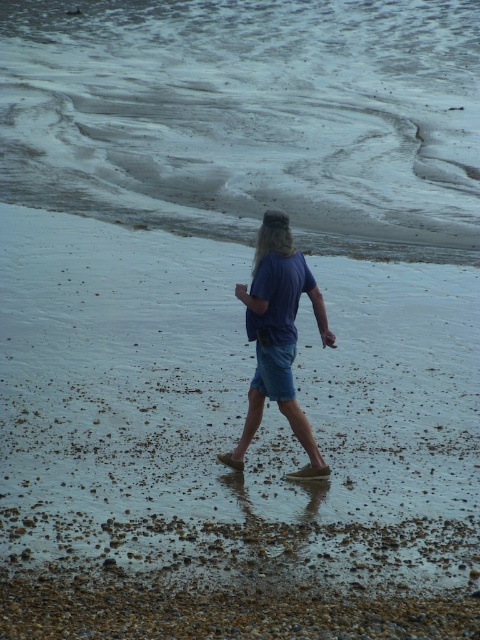
You are a hiker who wants to cross the beach to reach the water. You see the sandy water at center and the blue denim shorts at center. Which one is higher in elevation?

The sandy water at center is taller than blue denim shorts at center, so the sandy water at center is higher in elevation.

You are a photographer trying to capture the person walking on the beach. Which object in the scene, the smooth sand beach at center or the blonde hair at center, would you focus on first if you want to highlight the texture of the surface?

The smooth sand beach at center has a larger size compared to the blonde hair at center, making it easier to focus on its texture.

You are standing on the beach and see the sandy water at center and the blonde hair at center. Which object is located to the right side of the other?

The blonde hair at center is to the right of the sandy water at center.